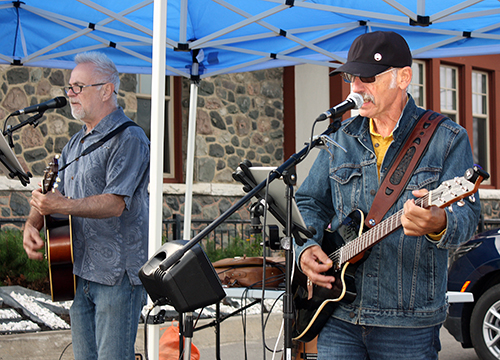
Locate an element on the screen. speaker is located at coordinates (187, 277).